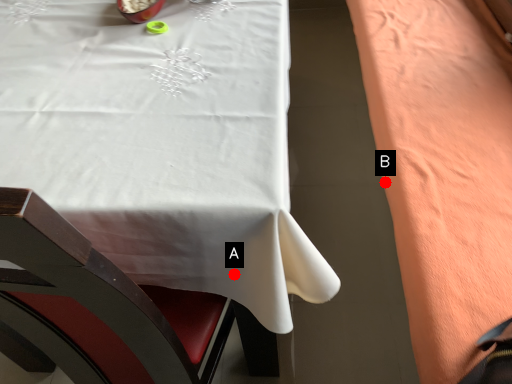
Question: Two points are circled on the image, labeled by A and B beside each circle. Which of the following is the closest to the observer?

Choices:
 (A) A is closer
 (B) B is closer

Answer: (A)